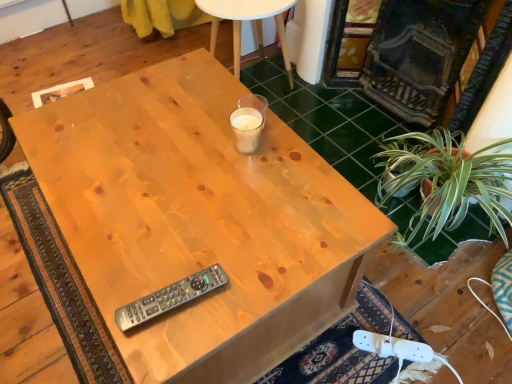
Question: From a real-world perspective, relative to translucent glass candle at center, the 2th coffee cup when ordered from top to bottom, is white paper cup at center, positioned as the first coffee cup in top-to-bottom order, vertically above or below?

Choices:
 (A) above
 (B) below

Answer: (B)

Question: Do you think white paper cup at center, the 2th coffee cup in the bottom-to-top sequence, is within translucent glass candle at center, the 2th coffee cup when ordered from top to bottom, or outside of it?

Choices:
 (A) inside
 (B) outside

Answer: (B)

Question: Based on their relative distances, which object is farther from the white paper cup at center, the 2th coffee cup in the bottom-to-top sequence?

Choices:
 (A) gray plastic remote at center
 (B) clear glass candle at upper center
 (C) natural wood desk at center
 (D) translucent glass candle at center, the 2th coffee cup when ordered from top to bottom

Answer: (B)

Question: Estimate the real-world distances between objects in this image. Which object is closer to the natural wood desk at center?

Choices:
 (A) gray plastic remote at center
 (B) clear glass candle at upper center
 (C) translucent glass candle at center, the 2th coffee cup when ordered from top to bottom
 (D) white paper cup at center, the 2th coffee cup in the bottom-to-top sequence

Answer: (C)